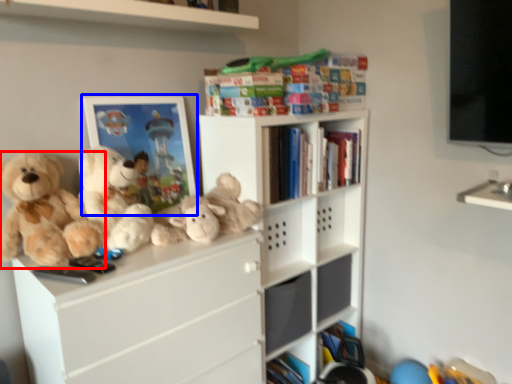
Question: Which point is further to the camera, teddy bear (highlighted by a red box) or picture frame (highlighted by a blue box)?

Choices:
 (A) teddy bear
 (B) picture frame

Answer: (B)